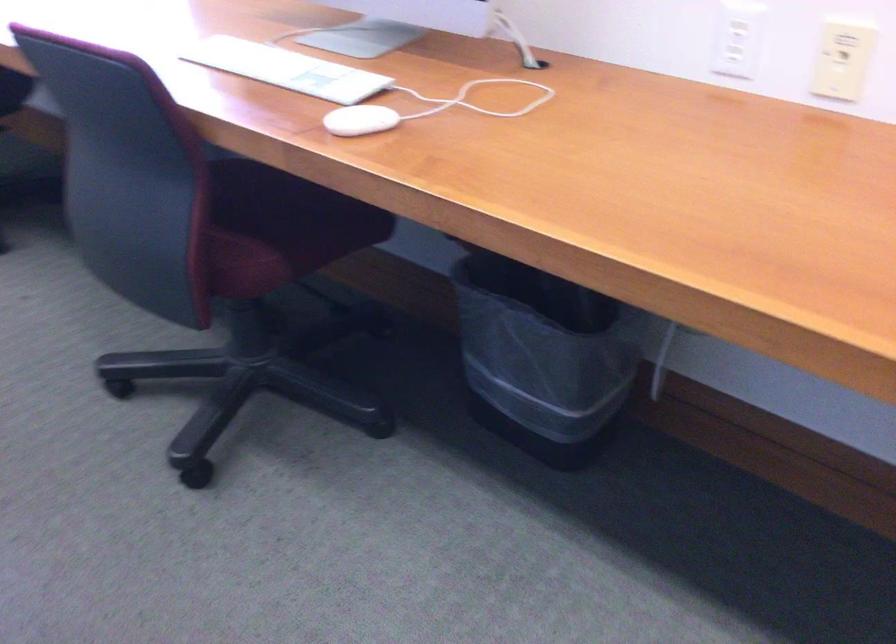
Identify the location of white electrical outlet. Image resolution: width=896 pixels, height=644 pixels. (737, 38).